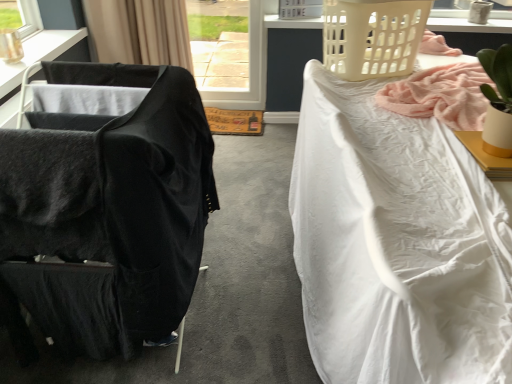
Identify the location of free region on the left part of white ceramic lamp at upper right, the 2th lamp positioned from the bottom. The height and width of the screenshot is (384, 512). coord(451,24).